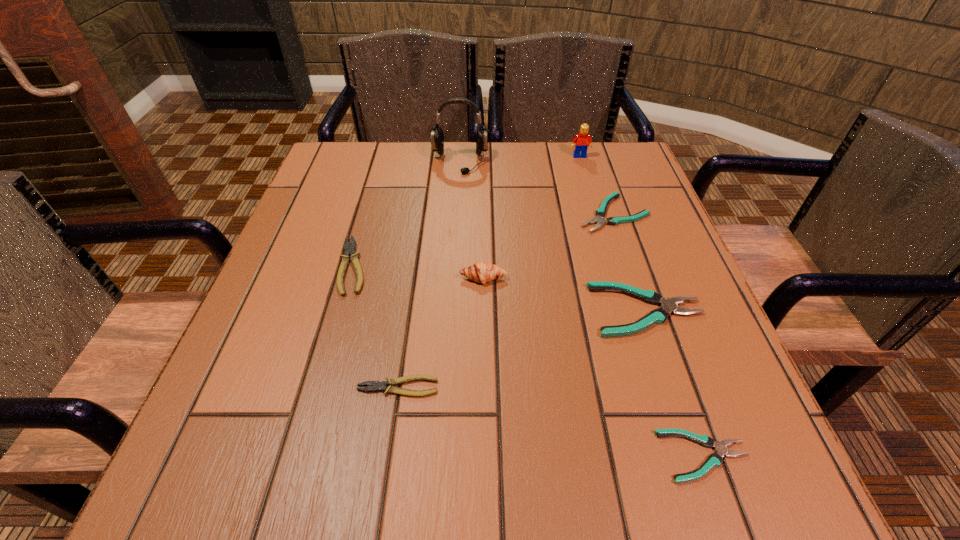
You are a GUI agent. You are given a task and a screenshot of the screen. Output one action in this format:
    pyautogui.click(x=<x>, y=<y>)
    Task: Click on the tallest object
    The height and width of the screenshot is (540, 960).
    Given the screenshot: What is the action you would take?
    pyautogui.click(x=437, y=135)

Identify the location of Lego. Image resolution: width=960 pixels, height=540 pixels. (581, 142).

Identify the location of red Lego. (581, 142).

I want to click on pastry, so click(482, 272).

Locate an element on the screen. the biggest teal pliers is located at coordinates (657, 316).

This screenshot has height=540, width=960. Find the location of `the farther yellow pliers`. the farther yellow pliers is located at coordinates (349, 250).

The width and height of the screenshot is (960, 540). What are the coordinates of `the leftmost object` in the screenshot? It's located at (349, 250).

Find the location of a particular element. This screenshot has height=540, width=960. the farthest pliers is located at coordinates (600, 213).

Locate an element on the screen. the farthest teal pliers is located at coordinates (600, 213).

Identify the location of the second nearest pliers. (377, 386).